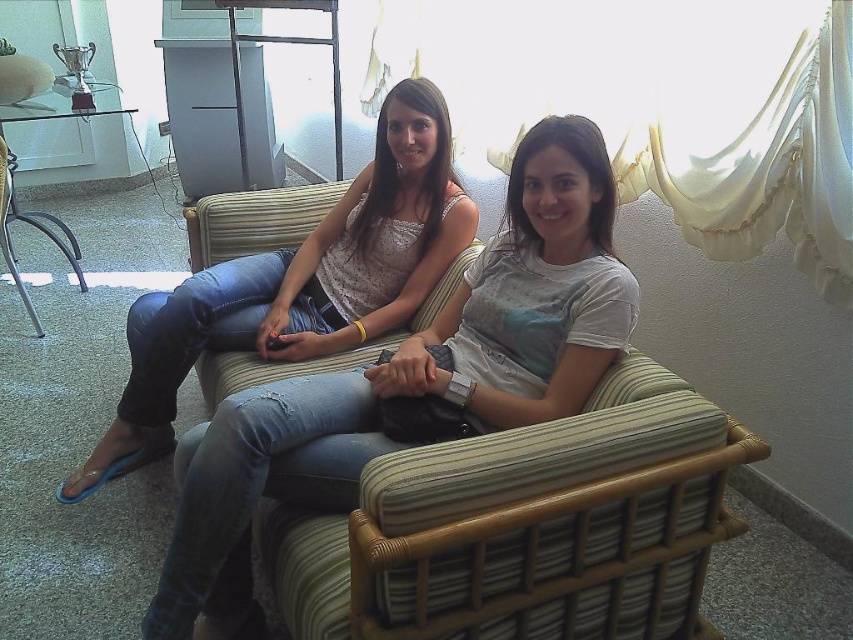
Between denim jeans at center and matte white tank top at center, which one is positioned lower?

Positioned lower is denim jeans at center.

Does point (300, 419) lie behind point (67, 497)?

That is False.

Find the location of a particular element. denim jeans at center is located at coordinates (413, 378).